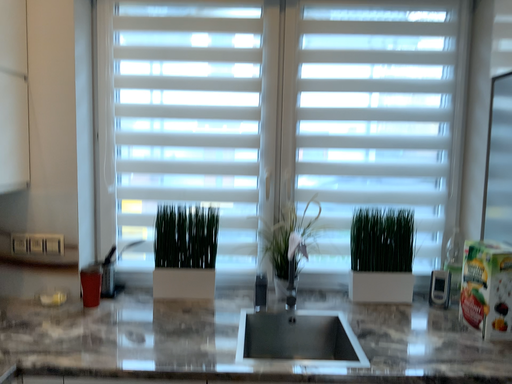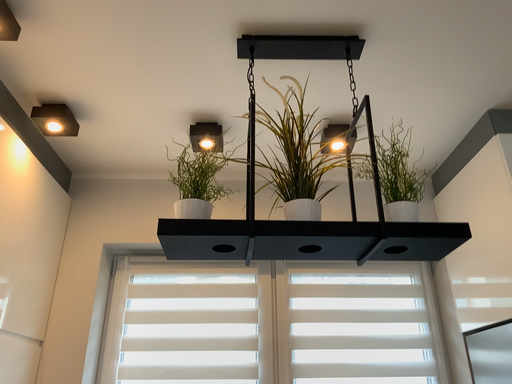
Question: How did the camera likely rotate when shooting the video?

Choices:
 (A) rotated downward
 (B) rotated upward

Answer: (B)